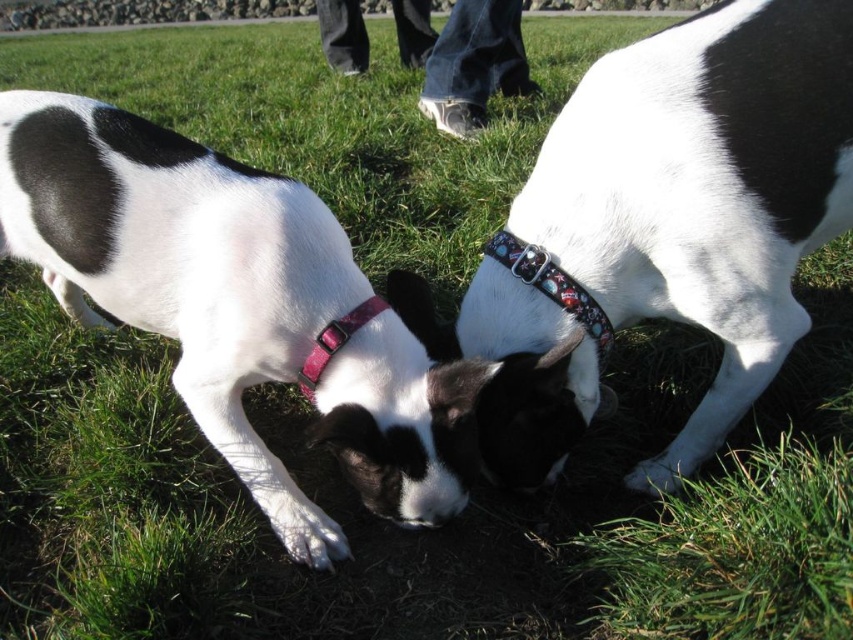
You are a drone operator trying to capture a photo of the two dogs. You need to position your drone so that the dog at point (749, 403) and the dog at point (329, 218) are both visible in the frame. Based on their positions, which dog is closer to the drone when it is directly above the paved path?

Point (329, 218) is in front of point (749, 403), so the dog at point (329, 218) is closer to the drone when it is directly above the paved path.